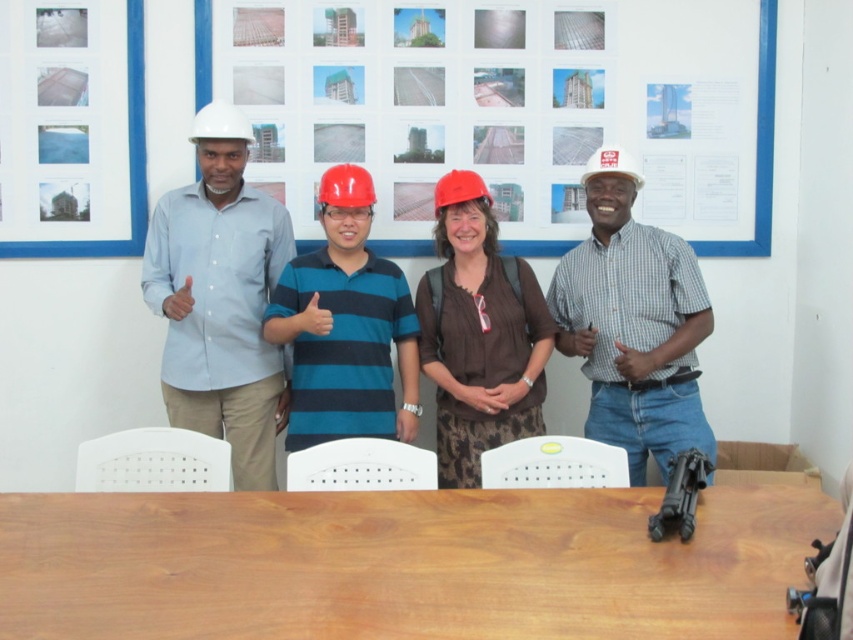
Can you confirm if white matte hard hat at right is positioned to the right of red matte helmet at center?

Yes, white matte hard hat at right is to the right of red matte helmet at center.

Is white matte hard hat at right bigger than red matte helmet at center?

Yes.

Is point (590, 216) positioned after point (358, 177)?

Yes, it is behind point (358, 177).

Locate an element on the screen. white matte hard hat at right is located at coordinates (633, 323).

Which is in front, point (201, 106) or point (247, 129)?

Positioned in front is point (247, 129).

At what (x,y) coordinates should I click in order to perform the action: click on white matte helmet at left. Please return your answer as a coordinate pair (x, y). The image size is (853, 640). Looking at the image, I should click on (219, 124).

Find the location of a particular element. white matte helmet at left is located at coordinates (219, 124).

Where is `white matte helmet at left`? The image size is (853, 640). white matte helmet at left is located at coordinates (219, 124).

Who is taller, metallic silver construction photos at upper center or white matte helmet at left?

With more height is metallic silver construction photos at upper center.

In the scene shown: Can you confirm if metallic silver construction photos at upper center is positioned to the left of white matte helmet at left?

In fact, metallic silver construction photos at upper center is to the right of white matte helmet at left.

Is point (509, 205) in front of point (247, 144)?

No, it is behind (247, 144).

This screenshot has width=853, height=640. In order to click on metallic silver construction photos at upper center in this screenshot , I will do `click(508, 108)`.